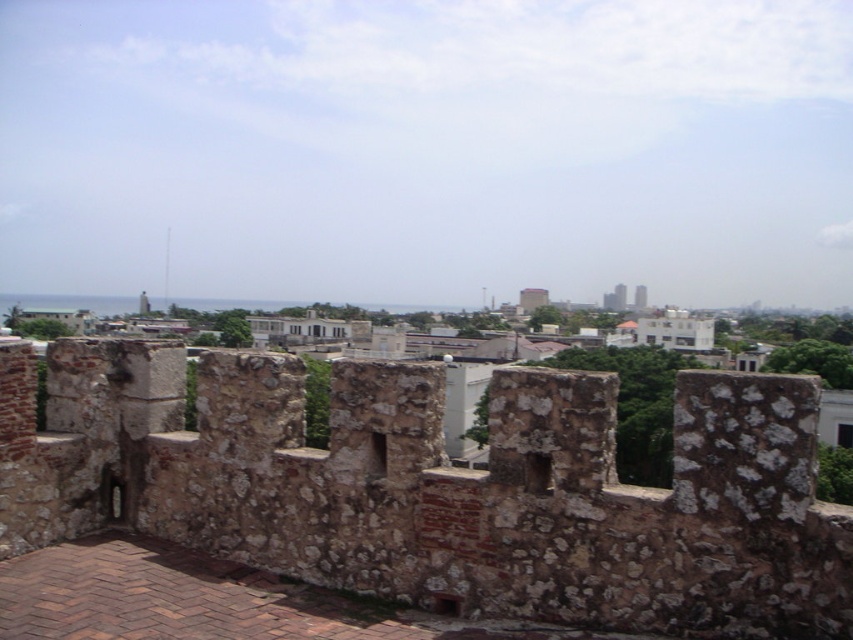
You are standing in front of a historical site and want to take a photo of the rustic stone wall at center. If you are exactly 56.80 feet away from it, will you be able to capture the entire wall in your camera frame without moving closer or farther?

Yes, since you are exactly 56.80 feet away from the rustic stone wall at center, which is the required distance to capture the entire wall in the camera frame without needing to adjust your position.

You are an architect planning to install a new sculpture between the smooth concrete tower at center and the white concrete tower at center. Which tower should the sculpture be closer to if you want it to appear proportionally balanced with both structures?

The sculpture should be placed closer to the white concrete tower at center because the smooth concrete tower at center is larger in size, so positioning the sculpture nearer to the smaller tower helps achieve a balanced visual composition.